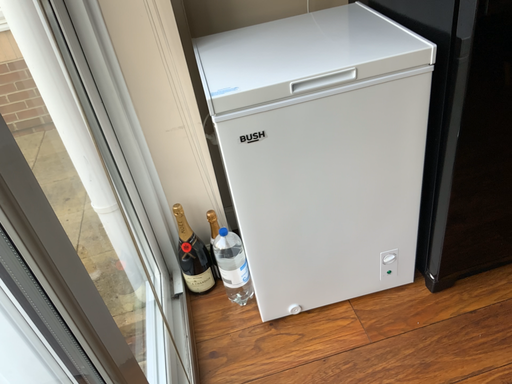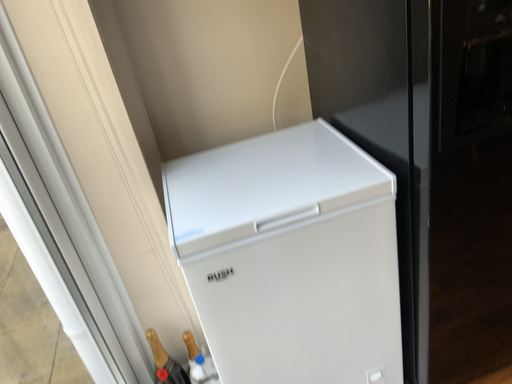
Question: How did the camera likely rotate when shooting the video?

Choices:
 (A) rotated downward
 (B) rotated upward

Answer: (B)